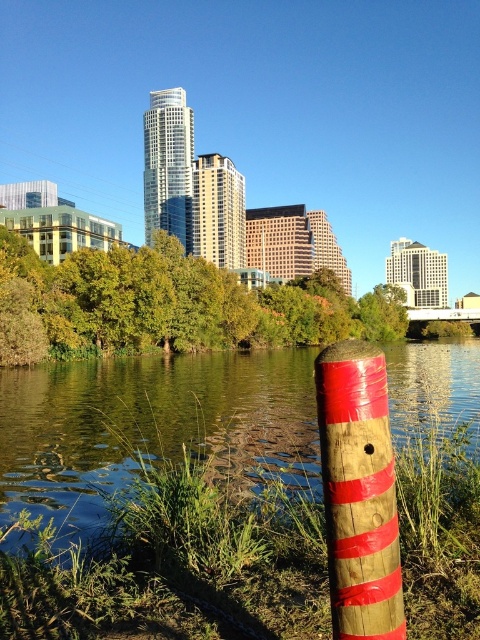
Question: Does green grass at lower left have a smaller size compared to wooden post with red stripes at center?

Choices:
 (A) yes
 (B) no

Answer: (B)

Question: In this image, where is green grass at lower left located relative to wooden post with red stripes at center?

Choices:
 (A) below
 (B) above

Answer: (A)

Question: Among these points, which one is nearest to the camera?

Choices:
 (A) (324, 512)
 (B) (240, 396)

Answer: (A)

Question: Is green grass at lower left positioned behind wooden post with red stripes at center?

Choices:
 (A) yes
 (B) no

Answer: (A)